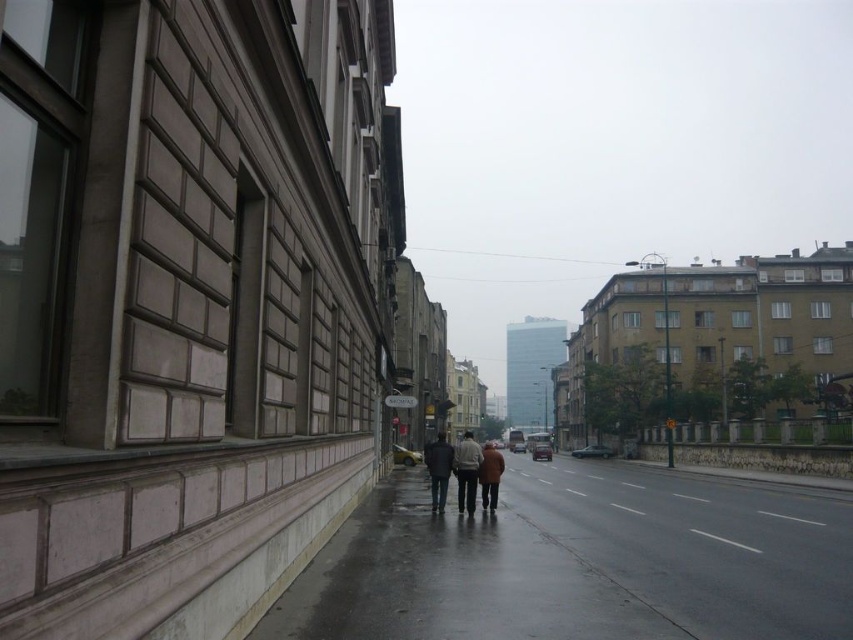
You are standing at the center of the street and want to reach the dark brown leather jacket at center. Which direction should you walk to get there?

Since the dark brown leather jacket at center is located at point (457, 468), you should walk towards the center of the street to reach it.

You are a pedestrian standing on the sidewalk in the urban street scene. You see a dark brown leather jacket at center located at point (457,468). Is the jacket closer to the building with the textured facade or to the road?

The dark brown leather jacket at center located at point (457,468) is closer to the road than the building with the textured facade because it is positioned in the middle ground away from the building and closer to the street.

You are a delivery person standing on the concrete sidewalk at lower center and need to hand a package to someone wearing the dark brown leather jacket at center. Can you reach them without leaving the sidewalk?

The concrete sidewalk at lower center is closer to the viewer than the dark brown leather jacket at center, so you can reach them while staying on the sidewalk.